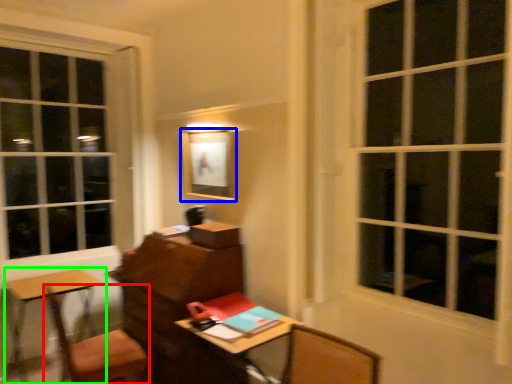
Question: Considering the real-world distances, which object is farthest from chair (highlighted by a red box)? picture frame (highlighted by a blue box) or table (highlighted by a green box)?

Choices:
 (A) picture frame
 (B) table

Answer: (A)